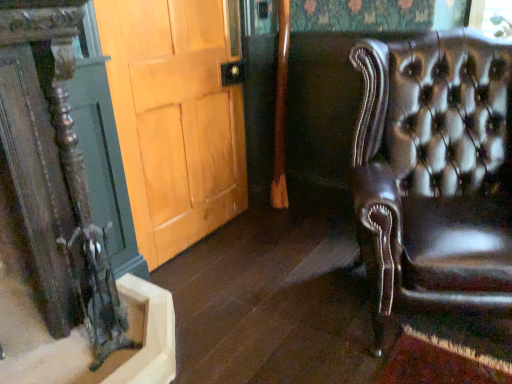
Question: Considering the positions of light brown wood door at center and brown leather chair at right in the image, is light brown wood door at center taller or shorter than brown leather chair at right?

Choices:
 (A) short
 (B) tall

Answer: (B)

Question: From a real-world perspective, is light brown wood door at center above or below brown leather chair at right?

Choices:
 (A) below
 (B) above

Answer: (B)

Question: From the image's perspective, is light brown wood door at center above or below brown leather chair at right?

Choices:
 (A) below
 (B) above

Answer: (B)

Question: In terms of height, does brown leather chair at right look taller or shorter compared to light brown wood door at center?

Choices:
 (A) tall
 (B) short

Answer: (B)

Question: Is brown leather chair at right bigger or smaller than light brown wood door at center?

Choices:
 (A) small
 (B) big

Answer: (B)

Question: Is brown leather chair at right spatially inside light brown wood door at center, or outside of it?

Choices:
 (A) outside
 (B) inside

Answer: (A)

Question: Considering the positions of point (490, 284) and point (103, 19), is point (490, 284) closer or farther from the camera than point (103, 19)?

Choices:
 (A) closer
 (B) farther

Answer: (A)